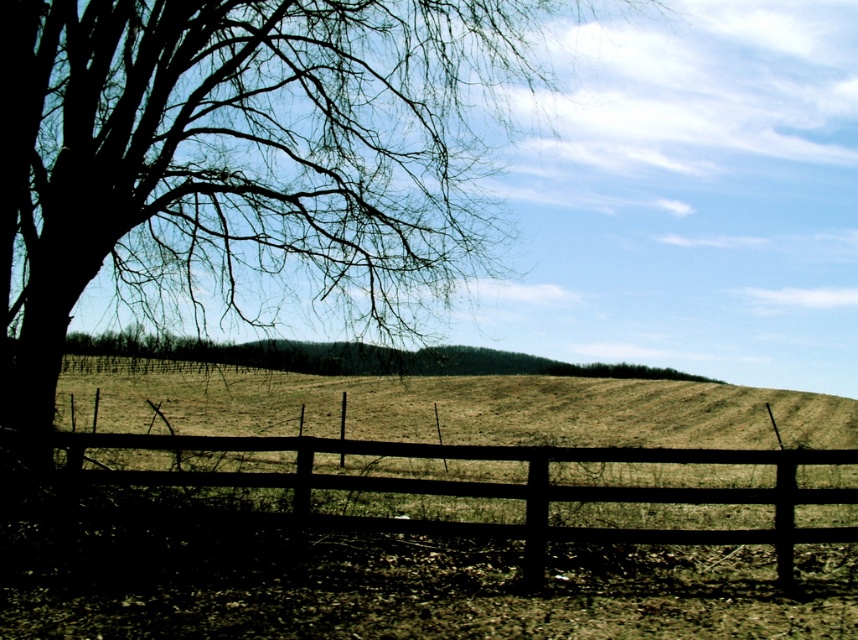
Can you confirm if silhouette bark tree at left is positioned to the right of brown textured tree at center?

Incorrect, silhouette bark tree at left is not on the right side of brown textured tree at center.

Which is in front, point (245, 188) or point (144, 336)?

Point (245, 188) is in front.

Locate an element on the screen. silhouette bark tree at left is located at coordinates (240, 163).

Who is taller, brown wooden fence at center or brown textured tree at center?

With more height is brown wooden fence at center.

Between brown wooden fence at center and brown textured tree at center, which one is positioned higher?

brown textured tree at center is above.

Describe the element at coordinates (494, 488) in the screenshot. The height and width of the screenshot is (640, 858). I see `brown wooden fence at center` at that location.

The image size is (858, 640). Find the location of `brown wooden fence at center`. brown wooden fence at center is located at coordinates (494, 488).

The image size is (858, 640). Describe the element at coordinates (240, 163) in the screenshot. I see `silhouette bark tree at left` at that location.

Who is more forward, (303, 161) or (620, 499)?

Point (620, 499) is more forward.

Where is `silhouette bark tree at left`? This screenshot has width=858, height=640. silhouette bark tree at left is located at coordinates (240, 163).